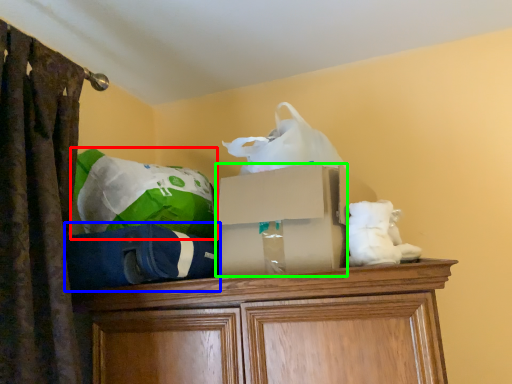
Question: Estimate the real-world distances between objects in this image. Which object is closer to bean bag chair (highlighted by a red box), bean bag chair (highlighted by a blue box) or storage box (highlighted by a green box)?

Choices:
 (A) bean bag chair
 (B) storage box

Answer: (A)